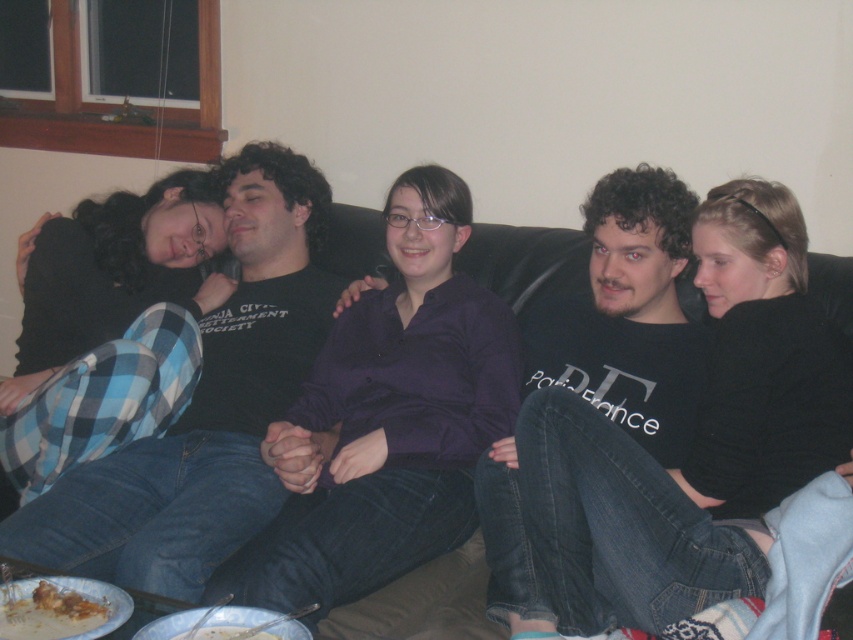
Question: Can you confirm if black cotton shirt at left is positioned to the left of black leather couch at center?

Choices:
 (A) no
 (B) yes

Answer: (B)

Question: Does brown crumbly food at lower left have a lesser width compared to white creamy food at lower center?

Choices:
 (A) no
 (B) yes

Answer: (B)

Question: Does black cotton shirt at left have a lesser width compared to dark gray t-shirt at center?

Choices:
 (A) yes
 (B) no

Answer: (B)

Question: Among these points, which one is farthest from the camera?

Choices:
 (A) (186, 636)
 (B) (692, 216)

Answer: (B)

Question: Which object appears closest to the camera in this image?

Choices:
 (A) white creamy food at lower center
 (B) black leather couch at center
 (C) black cotton shirt at left

Answer: (A)

Question: Which of the following is the farthest from the observer?

Choices:
 (A) (473, 611)
 (B) (244, 627)
 (C) (91, 616)
 (D) (157, 506)

Answer: (D)